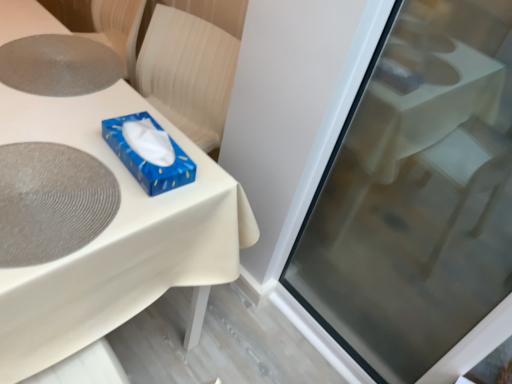
Question: From the image's perspective, is white glossy table at center above or below transparent glass screen door at upper right?

Choices:
 (A) below
 (B) above

Answer: (B)

Question: Does point (185, 339) appear closer or farther from the camera than point (356, 163)?

Choices:
 (A) closer
 (B) farther

Answer: (A)

Question: Estimate the real-world distances between objects in this image. Which object is closer to the transparent glass screen door at upper right?

Choices:
 (A) white glossy table at center
 (B) gray textured placemat at upper left, the 1th oval in the top-to-bottom sequence
 (C) blue glossy tissue box at upper center
 (D) matte gray placemat at upper left, the first oval in the bottom-to-top sequence

Answer: (A)

Question: Estimate the real-world distances between objects in this image. Which object is farther from the blue glossy tissue box at upper center?

Choices:
 (A) white glossy table at center
 (B) transparent glass screen door at upper right
 (C) matte gray placemat at upper left, which is the first oval from front to back
 (D) gray textured placemat at upper left, which is the first oval from back to front

Answer: (B)